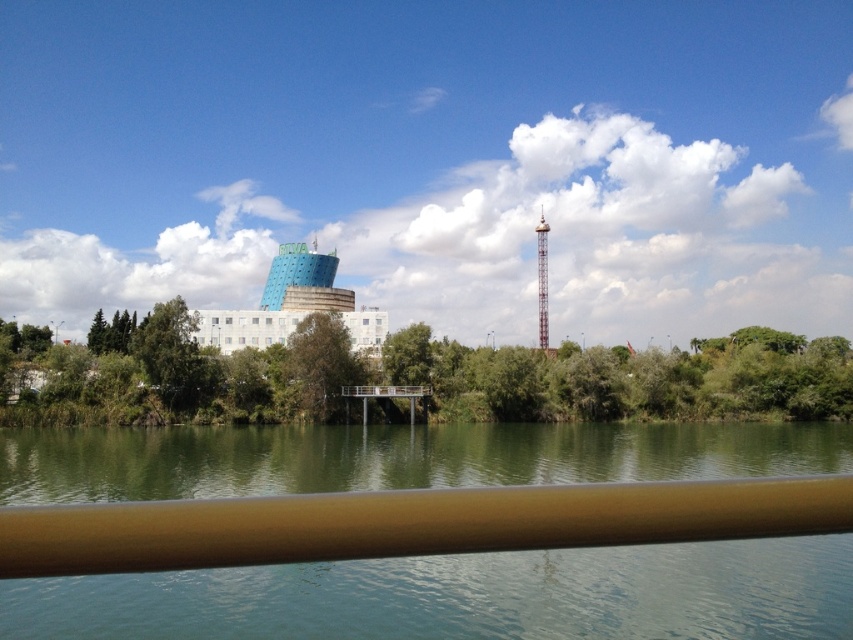
The image size is (853, 640). What do you see at coordinates (465, 596) in the screenshot?
I see `green smooth water at center` at bounding box center [465, 596].

Identify the location of green smooth water at center. The width and height of the screenshot is (853, 640). (465, 596).

Where is `green smooth water at center`? green smooth water at center is located at coordinates (465, 596).

Does brown smooth rail at lower center have a lesser height compared to green leafy tree at center?

Yes.

Is point (206, 552) positioned after point (289, 340)?

No, (206, 552) is in front of (289, 340).

I want to click on brown smooth rail at lower center, so click(410, 524).

Who is more forward, (51,545) or (540,237)?

Point (51,545)

Does brown smooth rail at lower center have a greater width compared to metallic silver tower at center-right?

No.

You are a GUI agent. You are given a task and a screenshot of the screen. Output one action in this format:
    pyautogui.click(x=<x>, y=<y>)
    Task: Click on the brown smooth rail at lower center
    This screenshot has height=640, width=853.
    Given the screenshot: What is the action you would take?
    pyautogui.click(x=410, y=524)